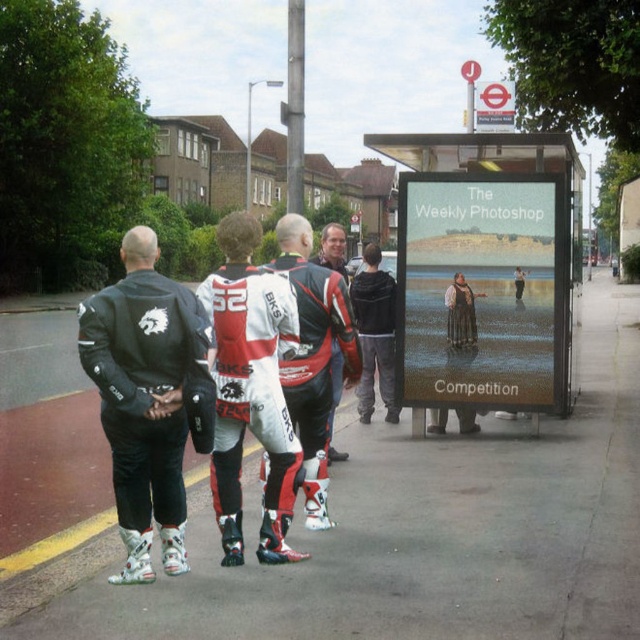
You are a photographer at the bus stop and want to take a photo of the matte black leather jacket at left and the leather jacket at center. Which jacket will appear larger in the photo?

The matte black leather jacket at left will appear larger in the photo because it is closer to the photographer than the leather jacket at center.